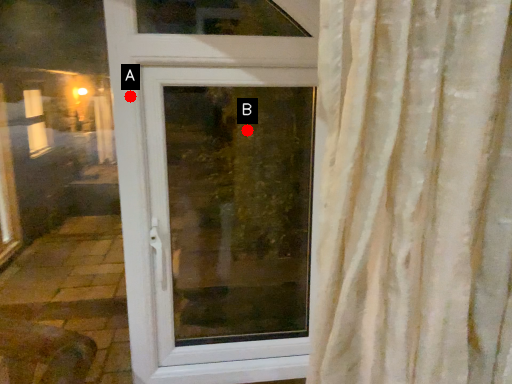
Question: Two points are circled on the image, labeled by A and B beside each circle. Which point is farther from the camera taking this photo?

Choices:
 (A) A is further
 (B) B is further

Answer: (B)